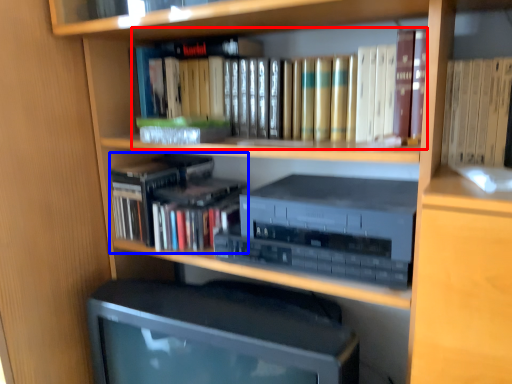
Question: Which of the following is the closest to the observer, book (highlighted by a red box) or book (highlighted by a blue box)?

Choices:
 (A) book
 (B) book

Answer: (A)